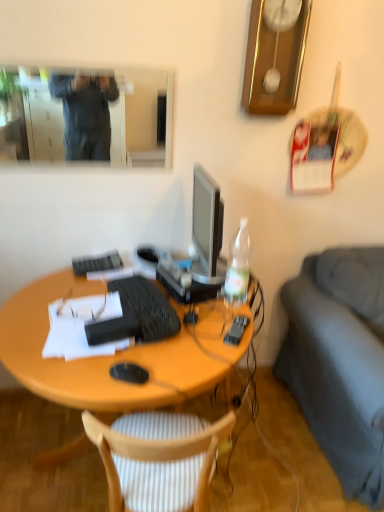
You are a GUI agent. You are given a task and a screenshot of the screen. Output one action in this format:
    pyautogui.click(x=<x>, y=<y>)
    Task: Click on the free spot to the left of matte black glasses at center
    The image size is (384, 512).
    Given the screenshot: What is the action you would take?
    pyautogui.click(x=49, y=301)